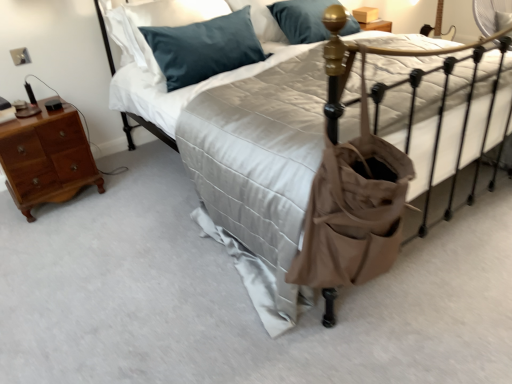
Where is `vacant space in front of light brown wood nightstand at left`? vacant space in front of light brown wood nightstand at left is located at coordinates (51, 230).